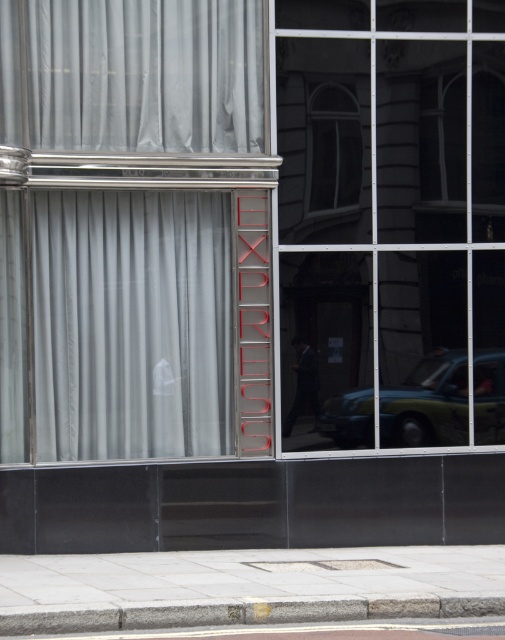
The height and width of the screenshot is (640, 505). In order to click on gray concrete pavement at lower center in this screenshot , I will do `click(245, 586)`.

What do you see at coordinates (245, 586) in the screenshot? Image resolution: width=505 pixels, height=640 pixels. I see `gray concrete pavement at lower center` at bounding box center [245, 586].

This screenshot has width=505, height=640. I want to click on gray concrete pavement at lower center, so click(245, 586).

Can you confirm if clear glass window at center is shorter than dark gray suit at center?

No.

Does clear glass window at center appear over dark gray suit at center?

Yes, clear glass window at center is above dark gray suit at center.

Is point (311, 189) positioned before point (298, 353)?

No, it is not.

Image resolution: width=505 pixels, height=640 pixels. I want to click on clear glass window at center, so click(x=333, y=147).

Can you confirm if white sheer curtain at center is shorter than gray concrete pavement at lower center?

In fact, white sheer curtain at center may be taller than gray concrete pavement at lower center.

Does white sheer curtain at center lie in front of gray concrete pavement at lower center?

No, it is not.

Between point (198, 56) and point (97, 628), which one is positioned in front?

Point (97, 628)

In order to click on white sheer curtain at center in this screenshot , I will do click(x=134, y=230).